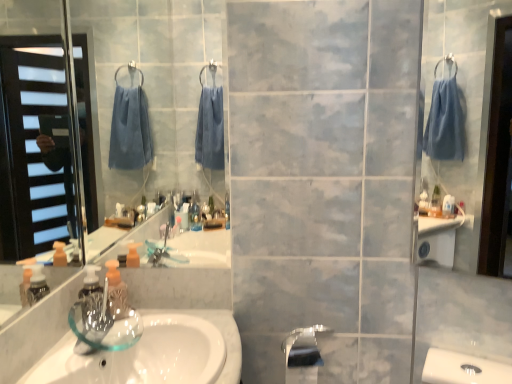
Question: Based on their sizes in the image, would you say white glossy sink at lower left is bigger or smaller than transparent glass soap dispenser at lower left?

Choices:
 (A) small
 (B) big

Answer: (B)

Question: Considering their positions, is white glossy sink at lower left located in front of or behind transparent glass soap dispenser at lower left?

Choices:
 (A) front
 (B) behind

Answer: (A)

Question: Based on their relative distances, which object is nearer to the transparent glass soap dispenser at lower left?

Choices:
 (A) satin nickel faucet at lower center
 (B) white glossy sink at lower left
 (C) satin nickel faucet at lower center

Answer: (B)

Question: Estimate the real-world distances between objects in this image. Which object is closer to the transparent glass soap dispenser at lower left?

Choices:
 (A) satin nickel faucet at lower center
 (B) satin nickel faucet at lower center
 (C) white glossy sink at lower left

Answer: (C)